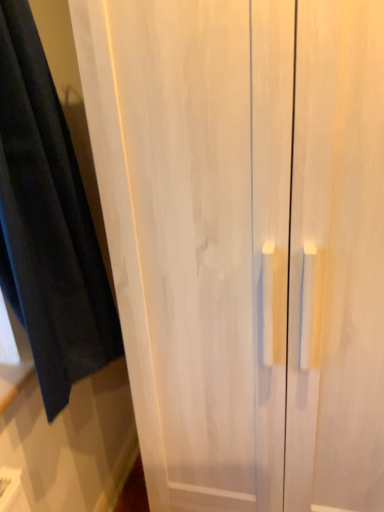
What is the approximate width of dark blue fabric at left?

9.21 inches.

Image resolution: width=384 pixels, height=512 pixels. Describe the element at coordinates (48, 223) in the screenshot. I see `dark blue fabric at left` at that location.

Locate an element on the screen. The width and height of the screenshot is (384, 512). dark blue fabric at left is located at coordinates (48, 223).

Where is `dark blue fabric at left`? The height and width of the screenshot is (512, 384). dark blue fabric at left is located at coordinates (48, 223).